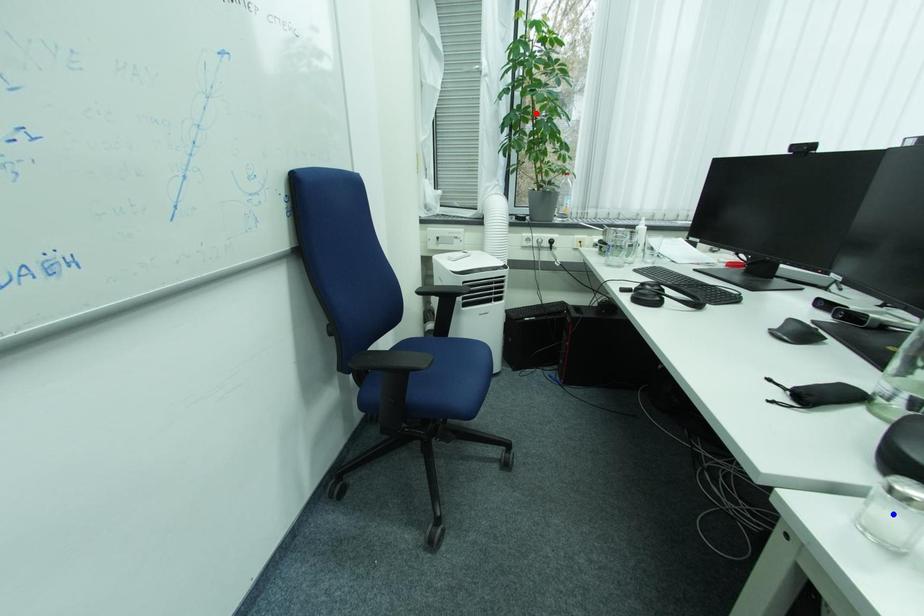
Question: In the image, two points are highlighted. Which point is nearer to the camera? Reply with the corresponding letter.

Choices:
 (A) blue point
 (B) red point

Answer: (A)